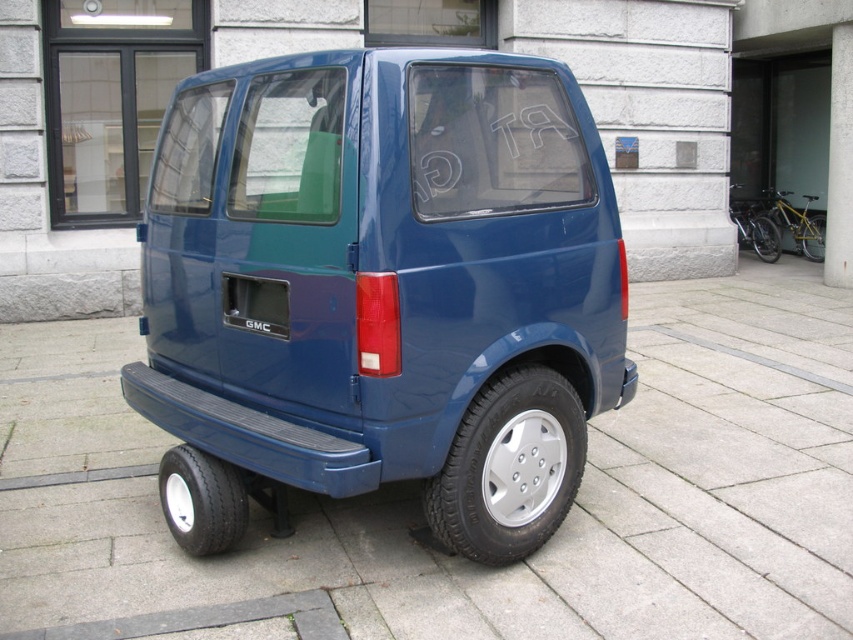
You are a delivery person with a 7 meter long truck. You need to park your truck between the smooth concrete pavement at center and the yellow matte bicycle at right. Is there enough space?

The distance between the smooth concrete pavement at center and the yellow matte bicycle at right is 6.96 meters. Since your truck is 7 meters long, there is not enough space to park between them.

You are a parking attendant and need to check the tire pressure of the black rubber tire at lower left located under the matte blue bumper at rear. Can you access the tire easily from the current position?

The black rubber tire at lower left is positioned under the matte blue bumper at rear, so it is likely accessible from the current position as it is directly beneath the bumper.

You are a delivery person trying to park your bike near the blue GMC van. The van is at the left side of the paved area. Your bike has a width of 0.8 meters. Can you park the yellow matte bicycle at right next to the van without overlapping the smooth concrete pavement at center?

The smooth concrete pavement at center is to the left of the yellow matte bicycle at right. Since the pavement is already positioned to the left of the bicycle, parking the yellow matte bicycle at right next to the van would not overlap the smooth concrete pavement at center. However, ensure there is enough space between the van and the bicycle to accommodate the bike width of 0.8 meters.